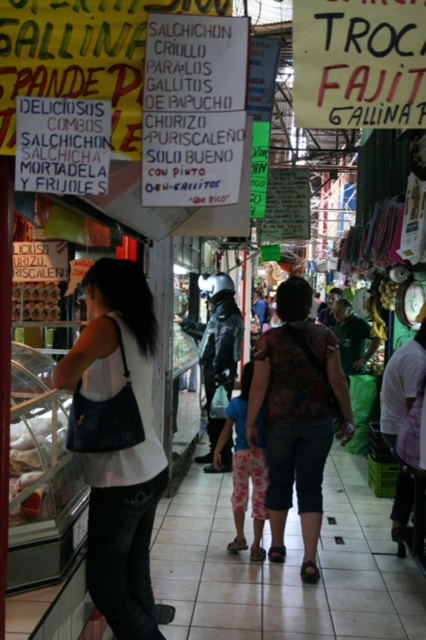
Question: Estimate the real-world distances between objects in this image. Which object is closer to the printed fabric blouse at center?

Choices:
 (A) matte brown bread at left
 (B) translucent plastic bag at left
 (C) matte black bag at left
 (D) white paper sign at upper center

Answer: (B)

Question: Which point appears closest to the camera in this image?

Choices:
 (A) (328, 76)
 (B) (26, 296)
 (C) (60, 483)

Answer: (A)

Question: Can you confirm if translucent plastic bag at left is positioned to the left of matte brown bread at left?

Choices:
 (A) yes
 (B) no

Answer: (B)

Question: Does matte black bag at left appear over translucent plastic bag at left?

Choices:
 (A) no
 (B) yes

Answer: (B)

Question: Is printed fabric blouse at center to the left of translucent plastic bag at left from the viewer's perspective?

Choices:
 (A) yes
 (B) no

Answer: (B)

Question: Which of the following is the closest to the observer?

Choices:
 (A) matte black bag at left
 (B) translucent plastic bag at left

Answer: (A)